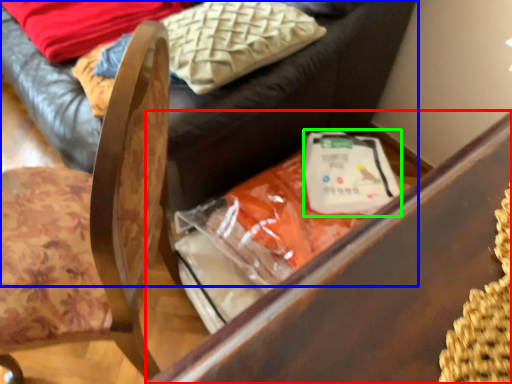
Question: Based on their relative distances, which object is farther from furniture (highlighted by a red box)? Choose from furniture (highlighted by a blue box) and food (highlighted by a green box).

Choices:
 (A) furniture
 (B) food

Answer: (B)